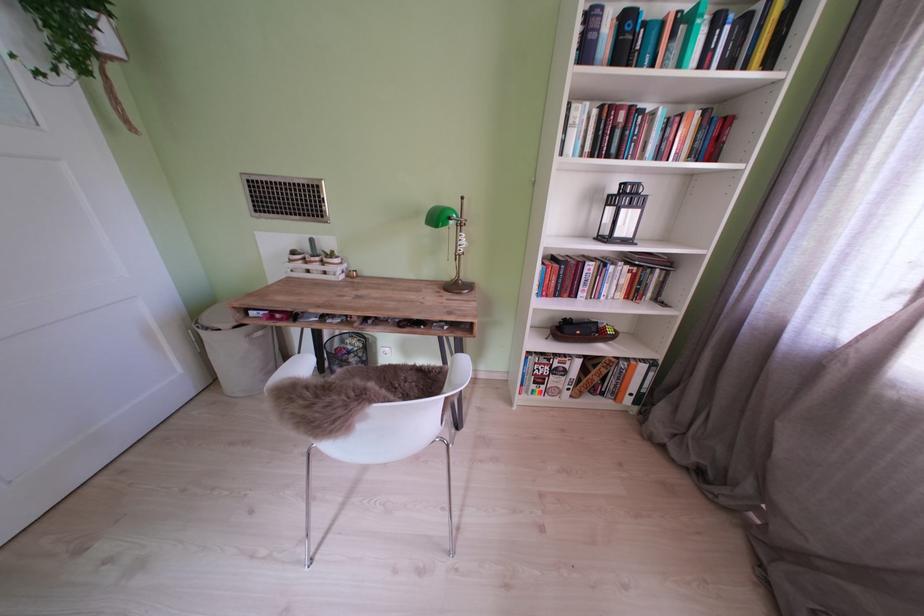
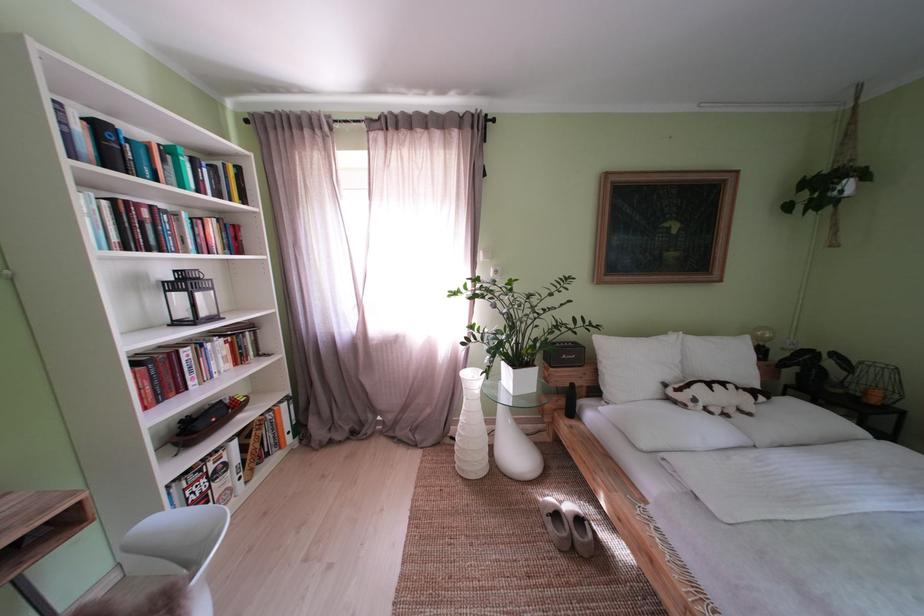
The point at [637,201] is marked in the first image. Where is the corresponding point in the second image?

(198, 286)